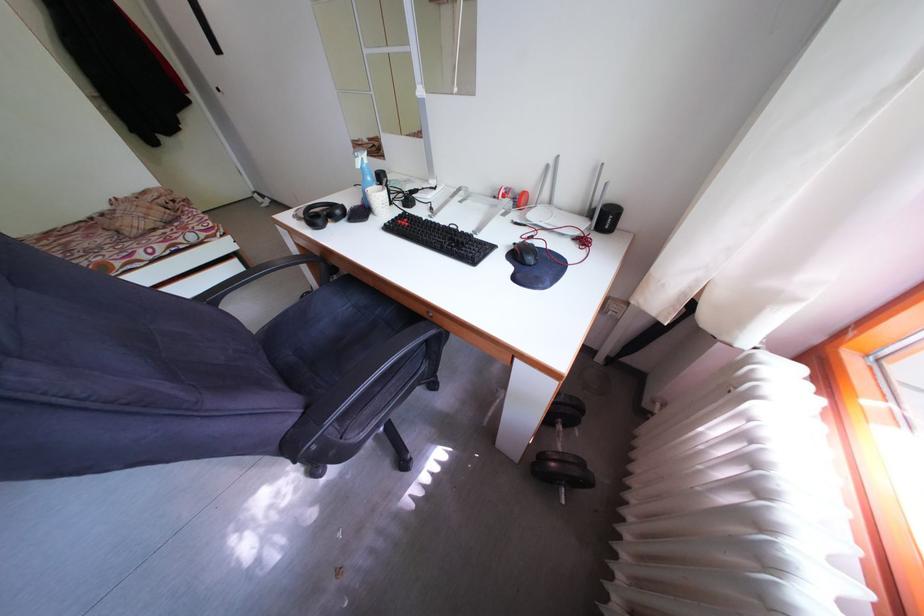
Where is `black chair armrest`? black chair armrest is located at coordinates (249, 277).